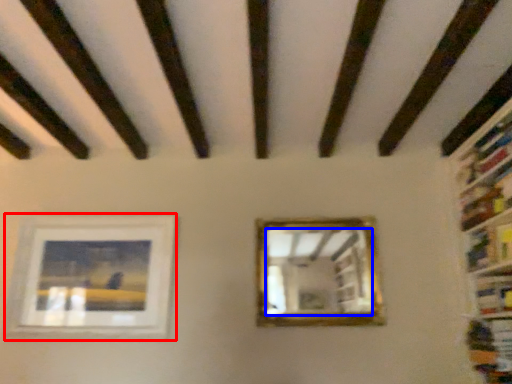
Question: Among these objects, which one is farthest to the camera, picture frame (highlighted by a red box) or mirror (highlighted by a blue box)?

Choices:
 (A) picture frame
 (B) mirror

Answer: (A)